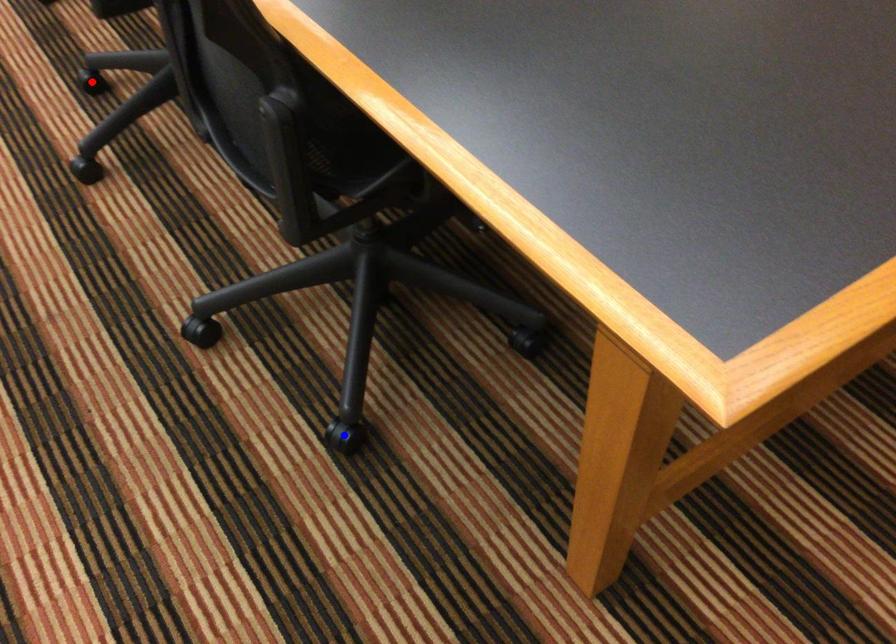
Question: Two points are marked on the image. Which point is closer to the camera?

Choices:
 (A) Blue point is closer.
 (B) Red point is closer.

Answer: (A)